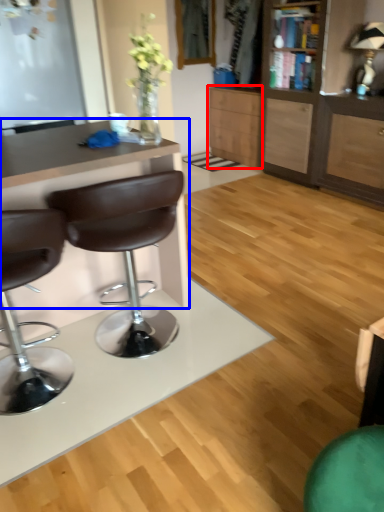
Question: Which object is further to the camera taking this photo, cabinetry (highlighted by a red box) or desk (highlighted by a blue box)?

Choices:
 (A) cabinetry
 (B) desk

Answer: (A)